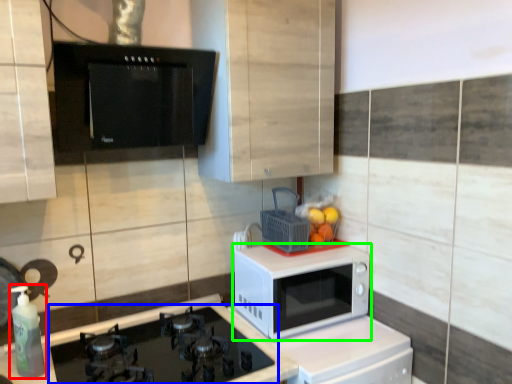
Question: Based on their relative distances, which object is nearer to bottle (highlighted by a red box)? Choose from gas stove (highlighted by a blue box) and microwave oven (highlighted by a green box).

Choices:
 (A) gas stove
 (B) microwave oven

Answer: (A)